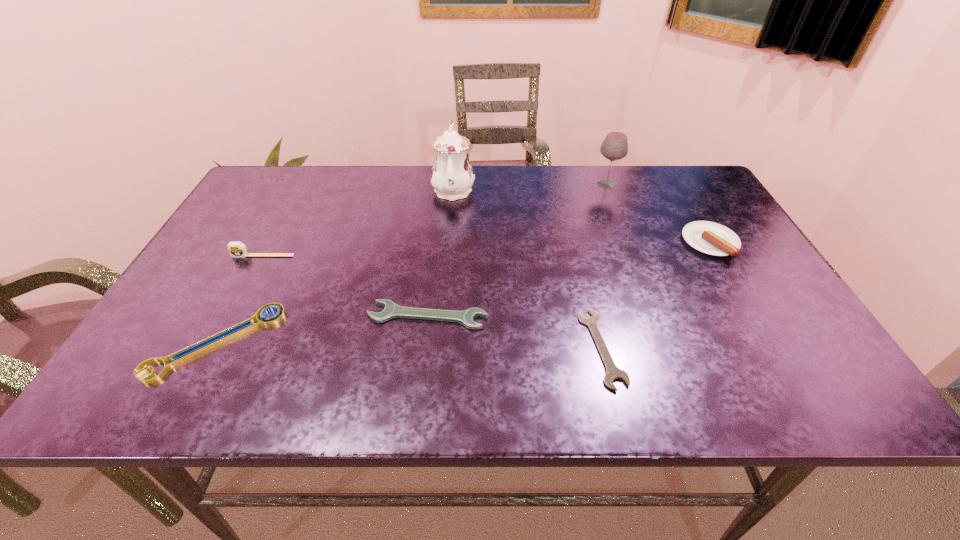
Identify the location of the tallest object. The width and height of the screenshot is (960, 540). (452, 176).

The height and width of the screenshot is (540, 960). Find the location of `the second tallest object`. the second tallest object is located at coordinates (614, 147).

Identify the location of wineglass. The width and height of the screenshot is (960, 540). (614, 147).

Identify the location of tape measure. The width and height of the screenshot is (960, 540). (236, 249).

In order to click on sausage in this screenshot , I will do `click(711, 238)`.

In order to click on the second wrench from right to left in this screenshot , I will do `click(391, 310)`.

Image resolution: width=960 pixels, height=540 pixels. I want to click on the leftmost wrench, so click(x=228, y=334).

Find the location of `the shortest wrench`. the shortest wrench is located at coordinates coord(613,372).

You are a GUI agent. You are given a task and a screenshot of the screen. Output one action in this format:
    pyautogui.click(x=<x>, y=<y>)
    Task: Click on the shortest object
    The image size is (960, 540).
    Given the screenshot: What is the action you would take?
    pyautogui.click(x=613, y=372)

Where is `vacant position located 0.320m on the front of the tallest object`? The width and height of the screenshot is (960, 540). vacant position located 0.320m on the front of the tallest object is located at coordinates (445, 291).